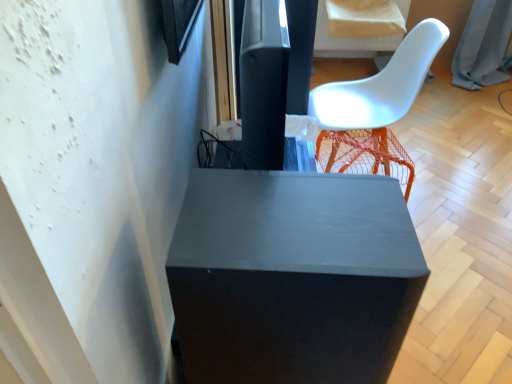
Where is `free space above orange mesh stool at right (from a real-world perspective)`? free space above orange mesh stool at right (from a real-world perspective) is located at coordinates point(365,137).